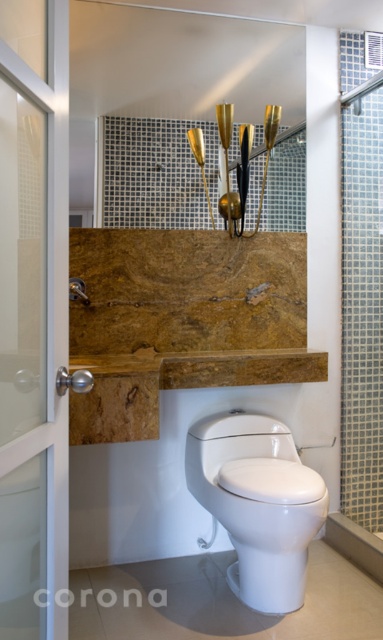
What object is located at the coordinates point [256,504] in the bathroom scene?

The white glossy toilet at center is located at point [256,504].

You are designing a bathroom layout and need to ensure that the white glossy toilet at center does not block the view of the clear glass door at left from the entrance. Based on their heights, is this possible?

The white glossy toilet at center has a lesser height compared to clear glass door at left, so it is possible to position them in a way that the toilet does not block the view of the door from the entrance since the door is taller.

You are designing a bathroom layout and need to ensure that the white glossy toilet at center and the clear glass door at left fit within a specific space. Based on their sizes, which object requires more floor space?

The white glossy toilet at center requires more floor space since it has a larger size compared to the clear glass door at left.